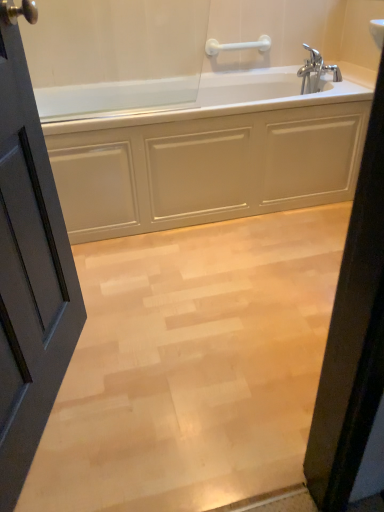
Where is `vacant space in matte gray door at left (from a real-world perspective)`? vacant space in matte gray door at left (from a real-world perspective) is located at coordinates (58, 409).